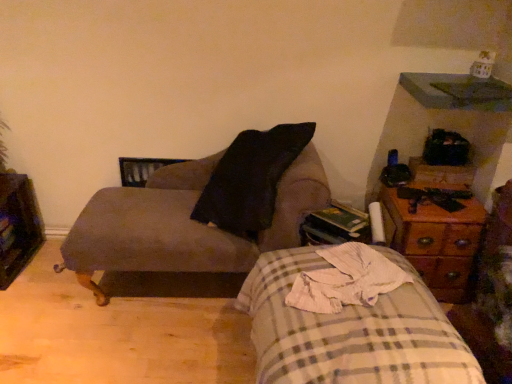
Question: Could woodenmaterial/texturenightstand at right be considered to be inside wooden dresser at left?

Choices:
 (A) yes
 (B) no

Answer: (B)

Question: From a real-world perspective, is wooden dresser at left beneath woodenmaterial/texturenightstand at right?

Choices:
 (A) no
 (B) yes

Answer: (B)

Question: Can you confirm if wooden dresser at left is taller than woodenmaterial/texturenightstand at right?

Choices:
 (A) no
 (B) yes

Answer: (A)

Question: Considering the relative positions of wooden dresser at left and woodenmaterial/texturenightstand at right in the image provided, is wooden dresser at left to the right of woodenmaterial/texturenightstand at right from the viewer's perspective?

Choices:
 (A) yes
 (B) no

Answer: (B)

Question: Does wooden dresser at left have a larger size compared to woodenmaterial/texturenightstand at right?

Choices:
 (A) no
 (B) yes

Answer: (A)

Question: From the image's perspective, is wooden dresser at left positioned above or below woodenmaterial/texturenightstand at right?

Choices:
 (A) above
 (B) below

Answer: (A)

Question: From their relative heights in the image, would you say wooden dresser at left is taller or shorter than woodenmaterial/texturenightstand at right?

Choices:
 (A) short
 (B) tall

Answer: (A)

Question: Which is correct: wooden dresser at left is inside woodenmaterial/texturenightstand at right, or outside of it?

Choices:
 (A) inside
 (B) outside

Answer: (B)

Question: Is wooden dresser at left to the left or to the right of woodenmaterial/texturenightstand at right in the image?

Choices:
 (A) right
 (B) left

Answer: (B)

Question: Based on their sizes in the image, would you say plaid fabric bed at lower right is bigger or smaller than woodenmaterial/texturenightstand at right?

Choices:
 (A) small
 (B) big

Answer: (B)

Question: Would you say plaid fabric bed at lower right is to the left or to the right of woodenmaterial/texturenightstand at right in the picture?

Choices:
 (A) right
 (B) left

Answer: (B)

Question: Choose the correct answer: Is plaid fabric bed at lower right inside woodenmaterial/texturenightstand at right or outside it?

Choices:
 (A) inside
 (B) outside

Answer: (B)

Question: From the image's perspective, is plaid fabric bed at lower right located above or below woodenmaterial/texturenightstand at right?

Choices:
 (A) above
 (B) below

Answer: (B)

Question: Is wooden dresser at left spatially inside plaid fabric bed at lower right, or outside of it?

Choices:
 (A) outside
 (B) inside

Answer: (A)

Question: In terms of width, does wooden dresser at left look wider or thinner when compared to plaid fabric bed at lower right?

Choices:
 (A) thin
 (B) wide

Answer: (A)